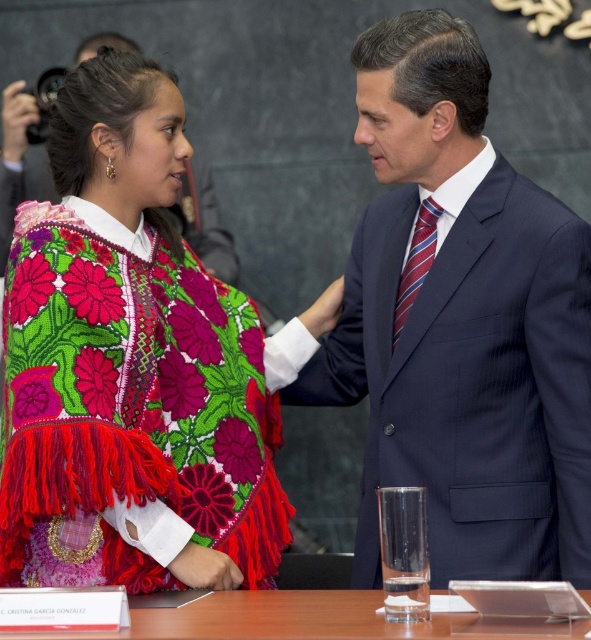
Question: Is dark blue pinstripe suit at center closer to camera compared to striped silk tie at center?

Choices:
 (A) no
 (B) yes

Answer: (B)

Question: Based on their relative distances, which object is nearer to the transparent glass at center?

Choices:
 (A) striped silk tie at center
 (B) matte black suit at center

Answer: (A)

Question: Which of the following is the closest to the observer?

Choices:
 (A) (424, 243)
 (B) (560, 632)
 (C) (428, 170)

Answer: (B)

Question: Considering the relative positions of dark blue pinstripe suit at center and embroidered wool poncho at center in the image provided, where is dark blue pinstripe suit at center located with respect to embroidered wool poncho at center?

Choices:
 (A) below
 (B) above

Answer: (B)

Question: Is the position of transparent glass at center more distant than that of striped silk tie at center?

Choices:
 (A) yes
 (B) no

Answer: (B)

Question: Which of the following is the closest to the observer?

Choices:
 (A) (x=404, y=291)
 (B) (x=24, y=193)
 (C) (x=70, y=246)
 (D) (x=189, y=625)

Answer: (D)